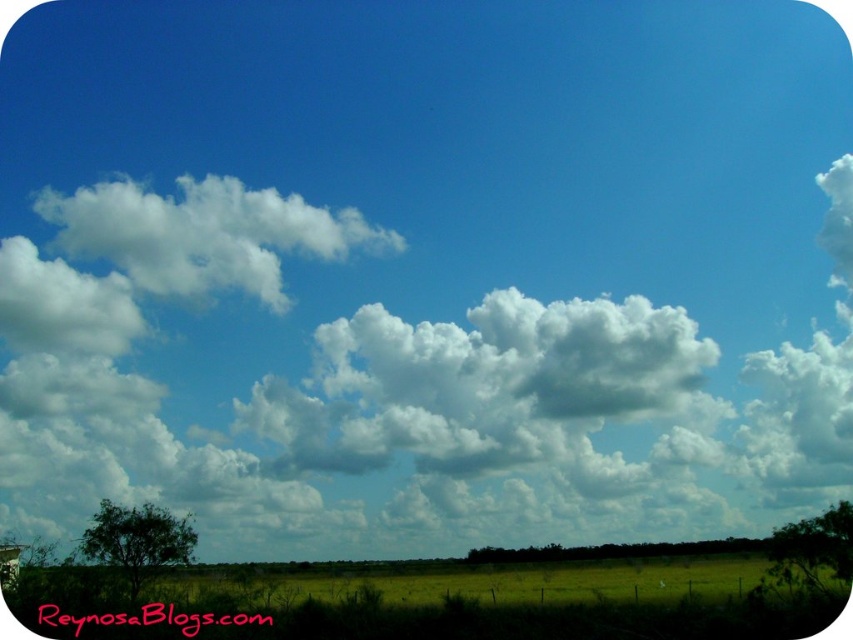
You are an artist painting this landscape. You want to ensure the white fluffy cloud at upper left and the green grass at lower center are proportionally accurate. Which object should you make smaller in your painting?

The white fluffy cloud at upper left should be made smaller because it occupies less space than the green grass at lower center in the scene.

You are standing in the field looking up at the sky. Which object, the white fluffy cloud at upper left or the green grass at lower center, is closer to your eyes?

The white fluffy cloud at upper left is closer to your eyes because the green grass at lower center is behind it.

You are standing in the field and want to take a photo of both the white fluffy cloud at upper left and the green grass at lower center. Which object is closer to you?

The green grass at lower center is closer to you since it is located in the lower center of the image, while the white fluffy cloud at upper left is farther away in the sky.